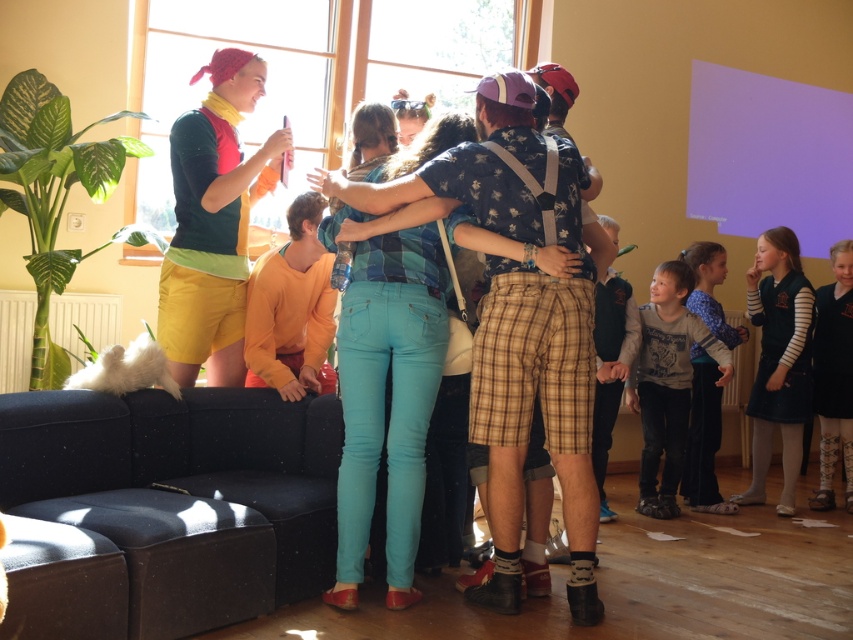
Is gray cotton shirt at lower right to the right of light gray sweater at lower right from the viewer's perspective?

Incorrect, gray cotton shirt at lower right is not on the right side of light gray sweater at lower right.

Is point (651, 342) positioned in front of point (708, 266)?

That is True.

This screenshot has height=640, width=853. Find the location of `gray cotton shirt at lower right`. gray cotton shirt at lower right is located at coordinates (666, 381).

Locate an element on the screen. gray cotton shirt at lower right is located at coordinates (666, 381).

Is matte green shorts at left above light gray sweater at lower right?

Yes.

Does point (212, 58) lie behind point (682, 483)?

That is False.

Is point (171, 166) positioned behind point (708, 304)?

No.

At what (x,y) coordinates should I click in order to perform the action: click on matte green shorts at left. Please return your answer as a coordinate pair (x, y). This screenshot has height=640, width=853. Looking at the image, I should click on (212, 224).

Can you confirm if dark blue fabric couch at lower left is positioned to the left of denim jeans at center?

Indeed, dark blue fabric couch at lower left is positioned on the left side of denim jeans at center.

Which is more to the left, dark blue fabric couch at lower left or denim jeans at center?

dark blue fabric couch at lower left is more to the left.

Image resolution: width=853 pixels, height=640 pixels. Describe the element at coordinates (183, 492) in the screenshot. I see `dark blue fabric couch at lower left` at that location.

The height and width of the screenshot is (640, 853). In order to click on dark blue fabric couch at lower left in this screenshot , I will do `click(183, 492)`.